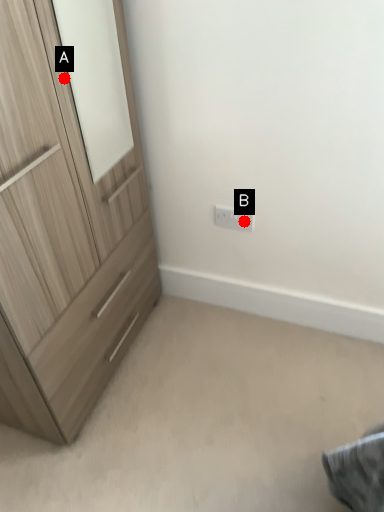
Question: Two points are circled on the image, labeled by A and B beside each circle. Which point is closer to the camera?

Choices:
 (A) A is closer
 (B) B is closer

Answer: (A)